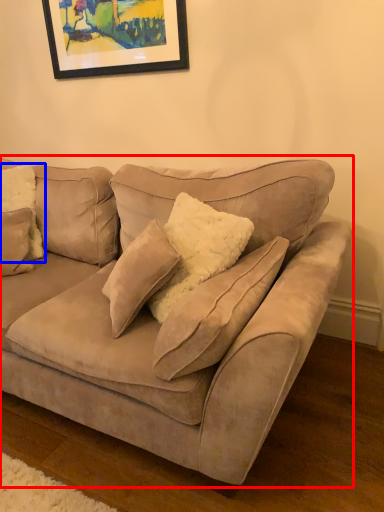
Question: Which object appears closest to the camera in this image, studio couch (highlighted by a red box) or pillow (highlighted by a blue box)?

Choices:
 (A) studio couch
 (B) pillow

Answer: (A)